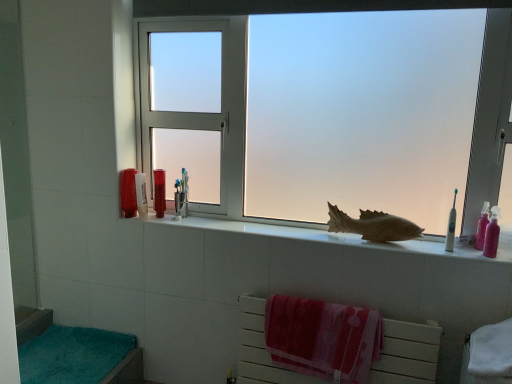
Question: From a real-world perspective, is teal plush bath towel at lower left positioned over translucent plastic container at left, which is counted as the 4th toiletry, starting from the right, based on gravity?

Choices:
 (A) yes
 (B) no

Answer: (B)

Question: Can you confirm if teal plush bath towel at lower left is positioned to the right of translucent plastic container at left, which is the 3th toiletry from front to back?

Choices:
 (A) yes
 (B) no

Answer: (B)

Question: Is teal plush bath towel at lower left behind translucent plastic container at left, the third toiletry when ordered from back to front?

Choices:
 (A) yes
 (B) no

Answer: (B)

Question: Are teal plush bath towel at lower left and translucent plastic container at left, which is counted as the 4th toiletry, starting from the right, far apart?

Choices:
 (A) no
 (B) yes

Answer: (A)

Question: Is teal plush bath towel at lower left to the left of translucent plastic container at left, acting as the second toiletry starting from the left, from the viewer's perspective?

Choices:
 (A) no
 (B) yes

Answer: (B)

Question: Considering the positions of pink glossy toiletries at right, placed as the 5th toiletry when sorted from back to front, and white plastic toothbrush at right in the image, is pink glossy toiletries at right, placed as the 5th toiletry when sorted from back to front, wider or thinner than white plastic toothbrush at right?

Choices:
 (A) thin
 (B) wide

Answer: (B)

Question: Considering the relative positions of pink glossy toiletries at right, which ranks as the fourth toiletry in left-to-right order, and white plastic toothbrush at right in the image provided, is pink glossy toiletries at right, which ranks as the fourth toiletry in left-to-right order, to the left or to the right of white plastic toothbrush at right?

Choices:
 (A) right
 (B) left

Answer: (A)

Question: From a real-world perspective, is pink glossy toiletries at right, placed as the 5th toiletry when sorted from back to front, above or below white plastic toothbrush at right?

Choices:
 (A) above
 (B) below

Answer: (B)

Question: Considering the positions of pink glossy toiletries at right, which appears as the 1th toiletry when viewed from the front, and white plastic toothbrush at right in the image, is pink glossy toiletries at right, which appears as the 1th toiletry when viewed from the front, bigger or smaller than white plastic toothbrush at right?

Choices:
 (A) small
 (B) big

Answer: (B)

Question: Does point (371, 236) appear closer or farther from the camera than point (476, 99)?

Choices:
 (A) farther
 (B) closer

Answer: (A)

Question: From the image's perspective, is brown matte fish at center located above or below frosted glass window at center?

Choices:
 (A) above
 (B) below

Answer: (B)

Question: From a real-world perspective, is brown matte fish at center above or below frosted glass window at center?

Choices:
 (A) above
 (B) below

Answer: (B)

Question: Is brown matte fish at center taller or shorter than frosted glass window at center?

Choices:
 (A) tall
 (B) short

Answer: (B)

Question: Based on their sizes in the image, would you say teal plush bath towel at lower left is bigger or smaller than pink glossy toothbrush at right, which appears as the fifth toiletry when viewed from the left?

Choices:
 (A) small
 (B) big

Answer: (B)

Question: Is teal plush bath towel at lower left wider or thinner than pink glossy toothbrush at right, placed as the first toiletry when sorted from right to left?

Choices:
 (A) wide
 (B) thin

Answer: (A)